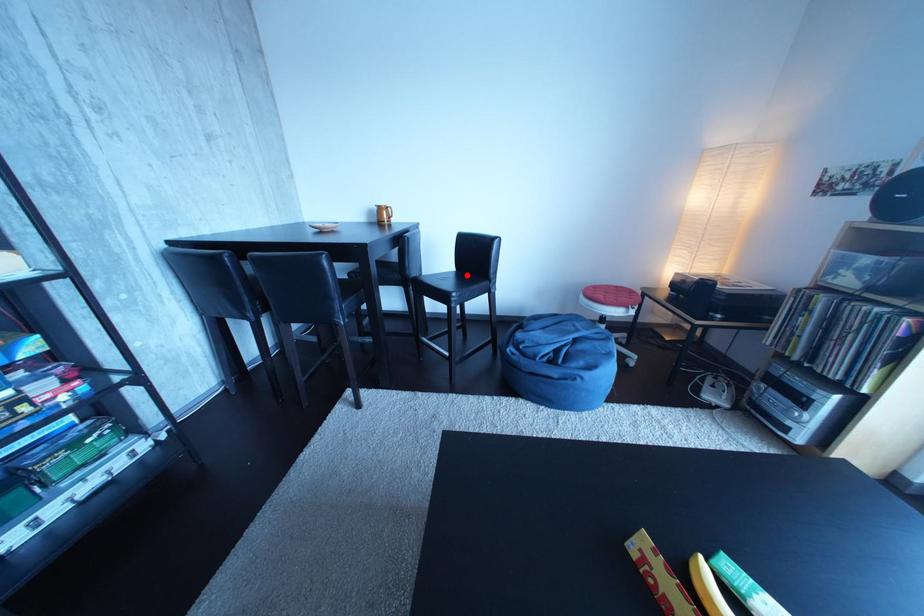
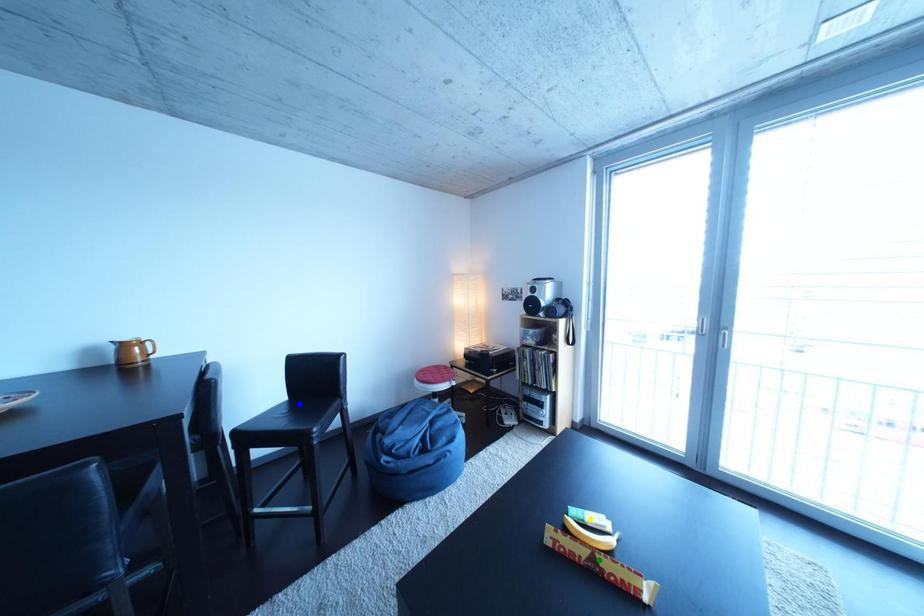
Question: I am providing you with two images of the same scene from different viewpoints. A red point is marked on the first image. You are given multiple points on the second image. In image 2, which mark is for the same physical point as the one in image 1?

Choices:
 (A) yellow point
 (B) green point
 (C) blue point

Answer: (C)